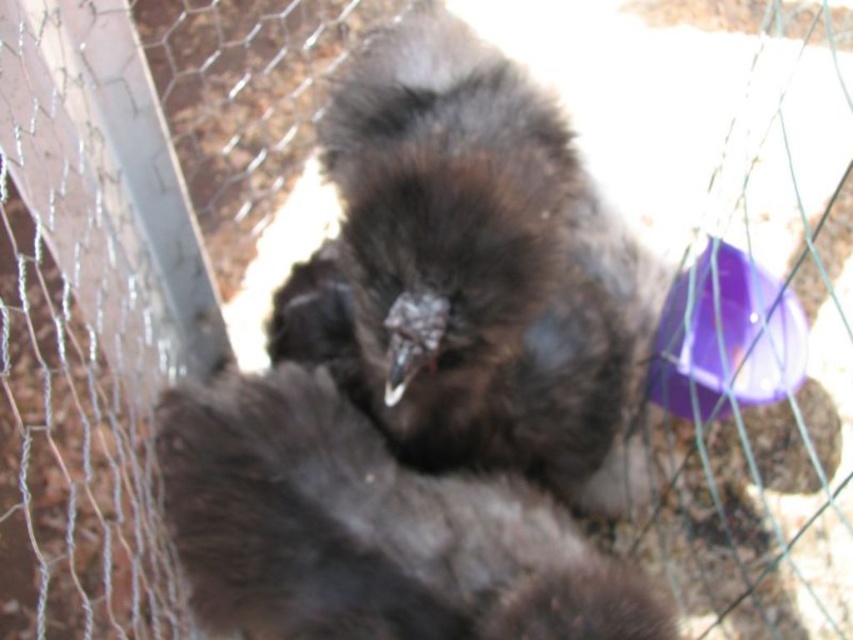
Question: Can you confirm if dark brown fluffy bird at center is positioned to the left of dark brown feathers at center?

Choices:
 (A) no
 (B) yes

Answer: (A)

Question: Among these points, which one is nearest to the camera?

Choices:
 (A) (488, 417)
 (B) (434, 484)

Answer: (B)

Question: Which point is closer to the camera?

Choices:
 (A) (412, 326)
 (B) (614, 627)

Answer: (B)

Question: Does dark brown fluffy bird at center appear under dark brown feathers at center?

Choices:
 (A) yes
 (B) no

Answer: (B)

Question: Is dark brown fluffy bird at center below dark brown feathers at center?

Choices:
 (A) yes
 (B) no

Answer: (B)